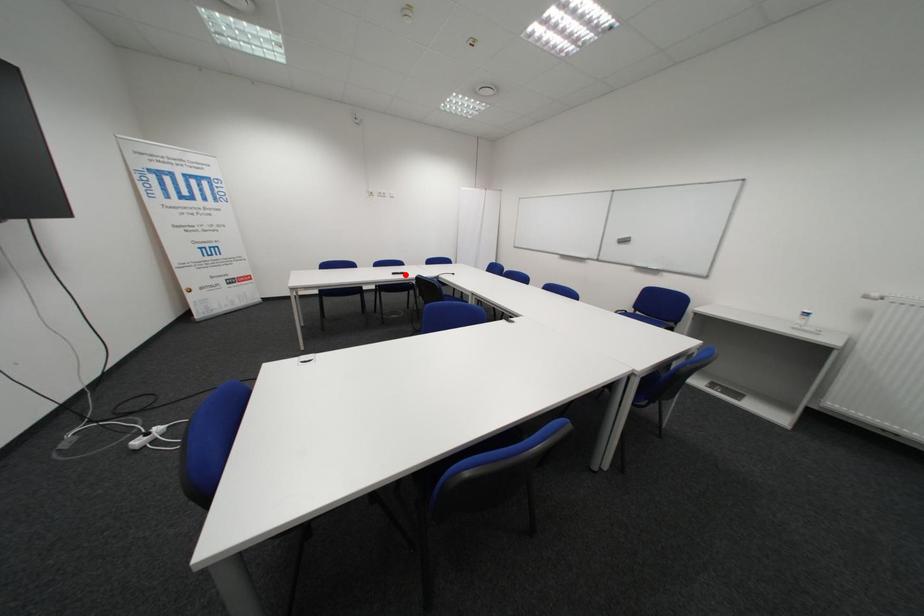
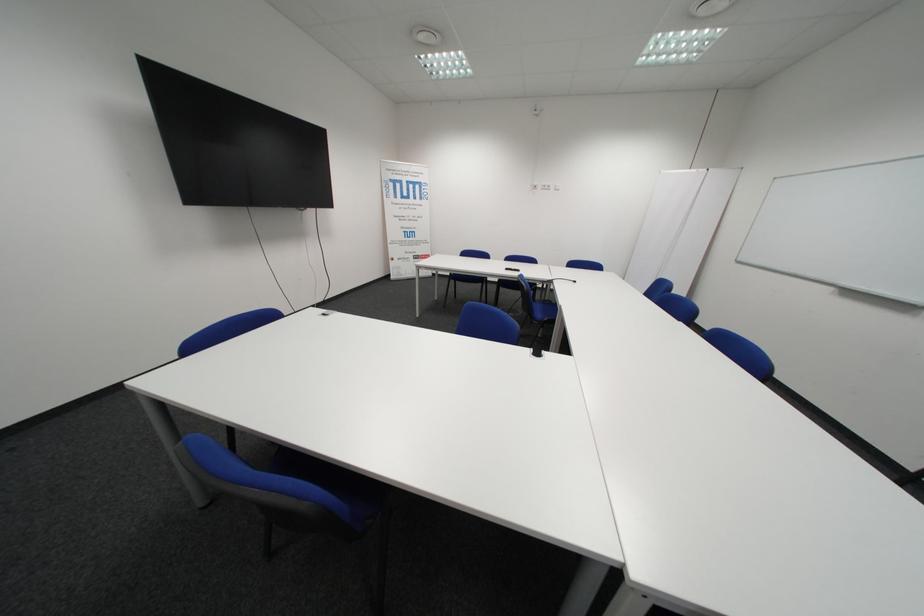
The point at the highlighted location is marked in the first image. Where is the corresponding point in the second image?

(518, 270)